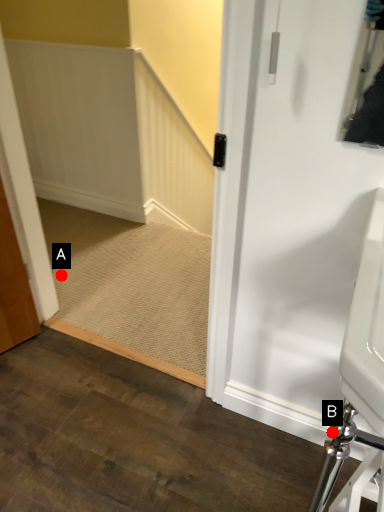
Question: Two points are circled on the image, labeled by A and B beside each circle. Among these points, which one is farthest from the camera?

Choices:
 (A) A is further
 (B) B is further

Answer: (A)